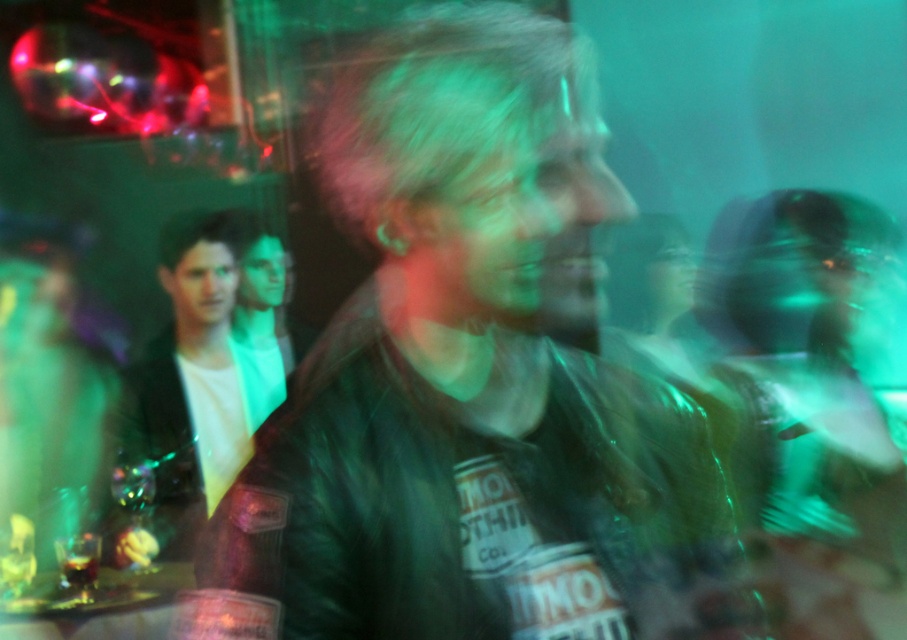
Question: Is leather jacket at center to the right of white leather jacket at left from the viewer's perspective?

Choices:
 (A) no
 (B) yes

Answer: (B)

Question: Is leather jacket at center wider than white leather jacket at left?

Choices:
 (A) yes
 (B) no

Answer: (A)

Question: Which of the following is the farthest from the observer?

Choices:
 (A) (571, 156)
 (B) (233, 422)

Answer: (B)

Question: Among these objects, which one is nearest to the camera?

Choices:
 (A) white leather jacket at left
 (B) leather jacket at center

Answer: (B)

Question: Is leather jacket at center wider than white leather jacket at left?

Choices:
 (A) yes
 (B) no

Answer: (A)

Question: Among these objects, which one is nearest to the camera?

Choices:
 (A) white leather jacket at left
 (B) leather jacket at center

Answer: (B)